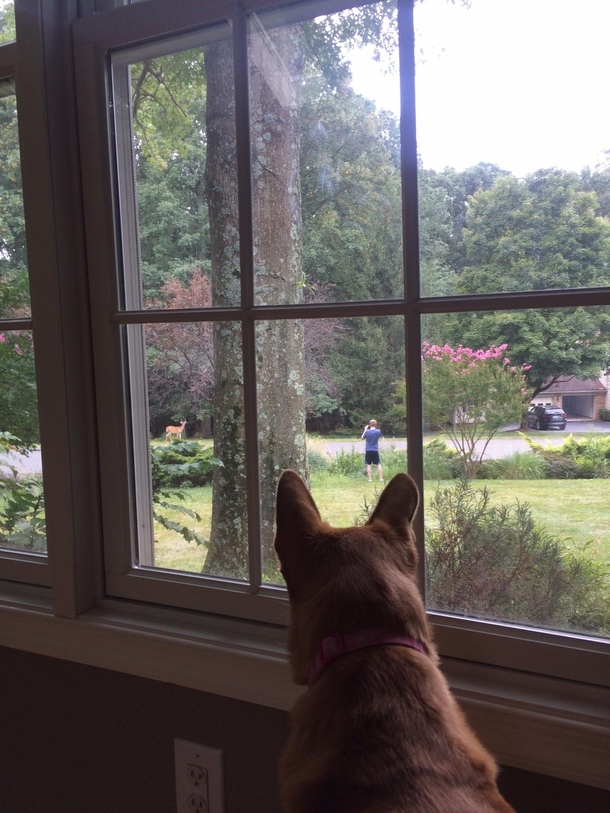
Identify the location of window seal. (218, 645), (16, 598), (537, 697).